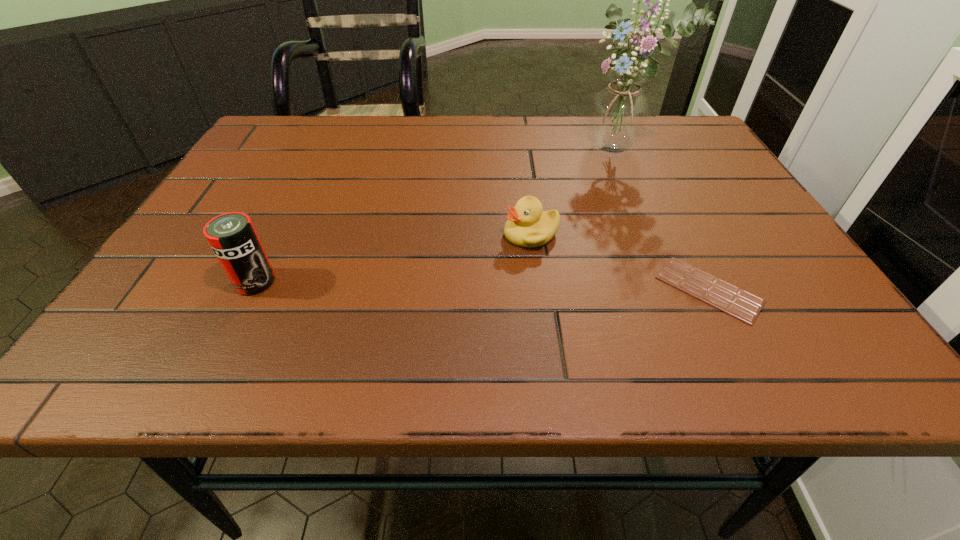
You are a GUI agent. You are given a task and a screenshot of the screen. Output one action in this format:
    pyautogui.click(x=<x>, y=<y>)
    Task: Click on the bouquet present at the right edge
    The height and width of the screenshot is (540, 960).
    Given the screenshot: What is the action you would take?
    point(618,117)

This screenshot has width=960, height=540. In order to click on object that is at the near left corner in this screenshot , I will do `click(232, 236)`.

Find the location of a particular element. object situated at the far right corner is located at coordinates (618, 117).

Where is `object situated at the near right corner`? object situated at the near right corner is located at coordinates (745, 306).

Where is `vacant area at the far edge of the desktop`? The height and width of the screenshot is (540, 960). vacant area at the far edge of the desktop is located at coordinates (577, 117).

Where is `vacant space at the near edge of the desktop`? The width and height of the screenshot is (960, 540). vacant space at the near edge of the desktop is located at coordinates (504, 322).

Where is `blank space at the left edge of the desktop`? blank space at the left edge of the desktop is located at coordinates (188, 281).

Locate an element on the screen. Image resolution: width=960 pixels, height=540 pixels. vacant space at the right edge of the desktop is located at coordinates (709, 184).

Find the location of a particular element. free location at the far right corner of the desktop is located at coordinates (699, 147).

Image resolution: width=960 pixels, height=540 pixels. I want to click on empty location between the chocolate bar and the second tallest object, so click(482, 286).